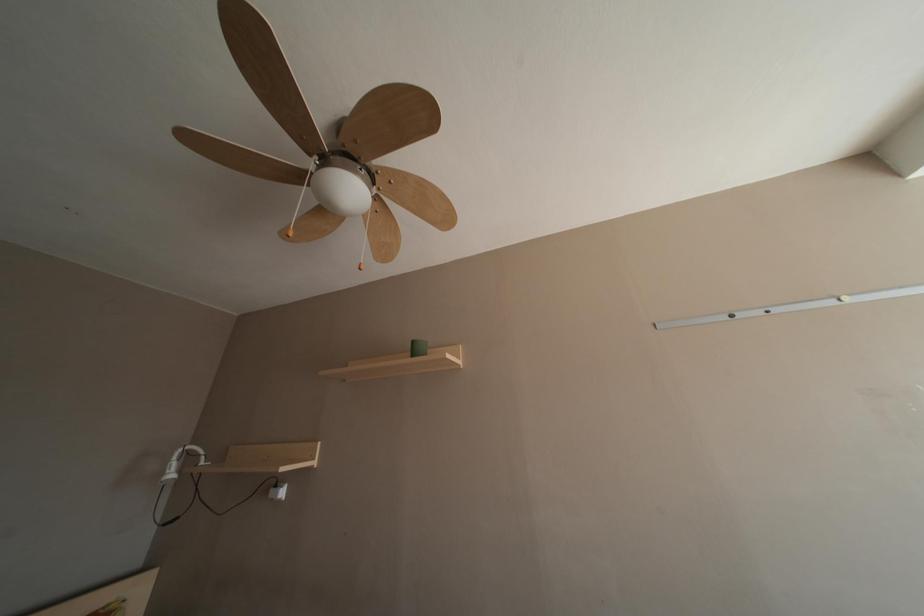
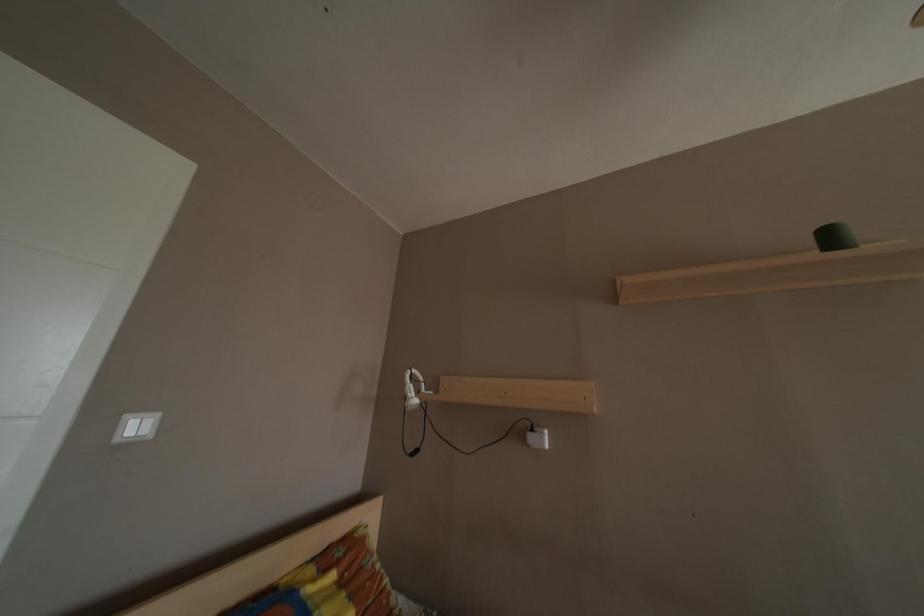
Question: What movement of the cameraman would produce the second image?

Choices:
 (A) Left
 (B) Right
 (C) Forward
 (D) Backward

Answer: (A)